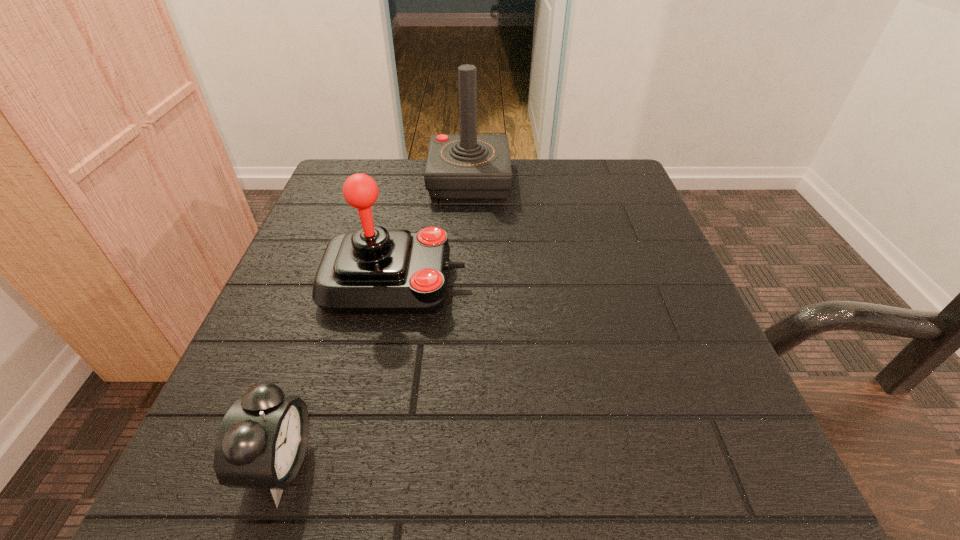
You are a GUI agent. You are given a task and a screenshot of the screen. Output one action in this format:
    pyautogui.click(x=<x>, y=<y>)
    Task: Click on the object present at the near edge
    
    Given the screenshot: What is the action you would take?
    pyautogui.click(x=261, y=444)

At what (x,y) coordinates should I click in order to perform the action: click on joystick situated at the left edge. Please return your answer as a coordinate pair (x, y). The height and width of the screenshot is (540, 960). Looking at the image, I should click on coord(371,270).

Find the location of a particular element. alarm clock located in the left edge section of the desktop is located at coordinates (261, 444).

Where is `object located in the near left corner section of the desktop`? Image resolution: width=960 pixels, height=540 pixels. object located in the near left corner section of the desktop is located at coordinates (261, 444).

In the image, there is a desktop. Find the location of `vacant area at the far edge`. vacant area at the far edge is located at coordinates point(530,210).

The height and width of the screenshot is (540, 960). What are the coordinates of `free spot at the near edge of the desktop` in the screenshot? It's located at (471, 441).

The image size is (960, 540). What are the coordinates of `vacant region at the right edge of the desktop` in the screenshot? It's located at (639, 222).

At what (x,y) coordinates should I click in order to perform the action: click on vacant space at the far left corner. Please return your answer as a coordinate pair (x, y). The width and height of the screenshot is (960, 540). Looking at the image, I should click on (324, 207).

Locate an element on the screen. The height and width of the screenshot is (540, 960). blank space at the far right corner is located at coordinates (622, 160).

You are a GUI agent. You are given a task and a screenshot of the screen. Output one action in this format:
    pyautogui.click(x=<x>, y=<y>)
    Task: Click on the blank area at the near right corner
    This screenshot has height=540, width=960.
    Given the screenshot: What is the action you would take?
    pyautogui.click(x=756, y=496)